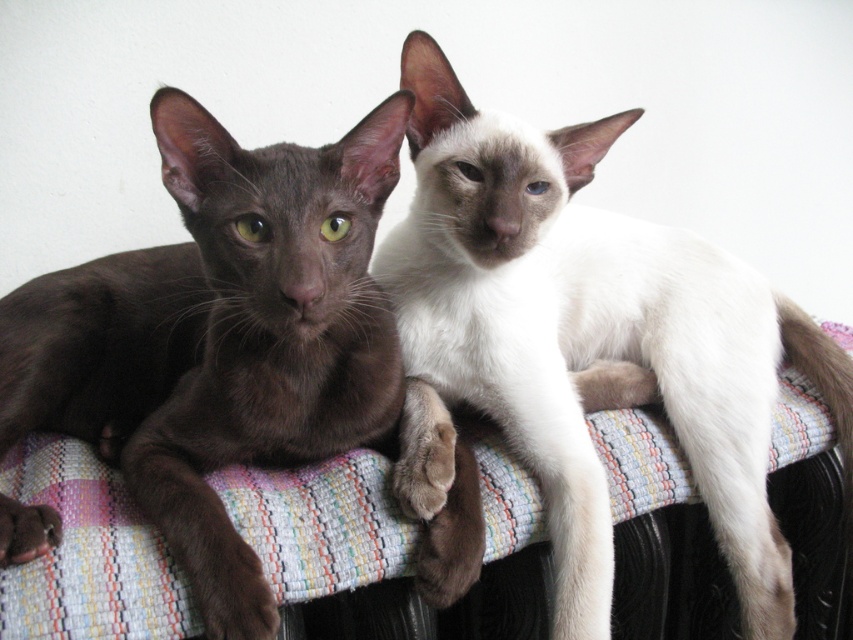
Does white silky fur cat at center have a smaller size compared to shiny brown cat at left?

No, white silky fur cat at center is not smaller than shiny brown cat at left.

Is point (440, 344) positioned before point (155, 132)?

No.

Locate an element on the screen. The height and width of the screenshot is (640, 853). white silky fur cat at center is located at coordinates (584, 340).